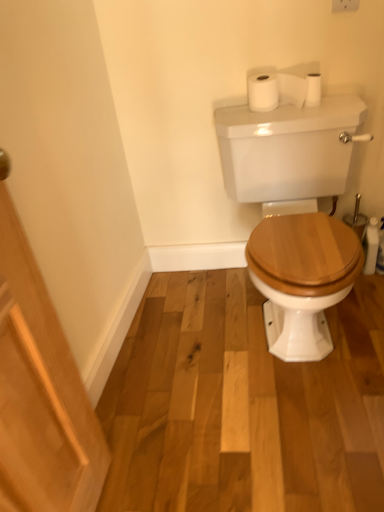
Image resolution: width=384 pixels, height=512 pixels. What are the coordinates of `free space to the right of white matte toilet paper at upper right, the 2th toilet paper viewed from the left` in the screenshot? It's located at (340, 105).